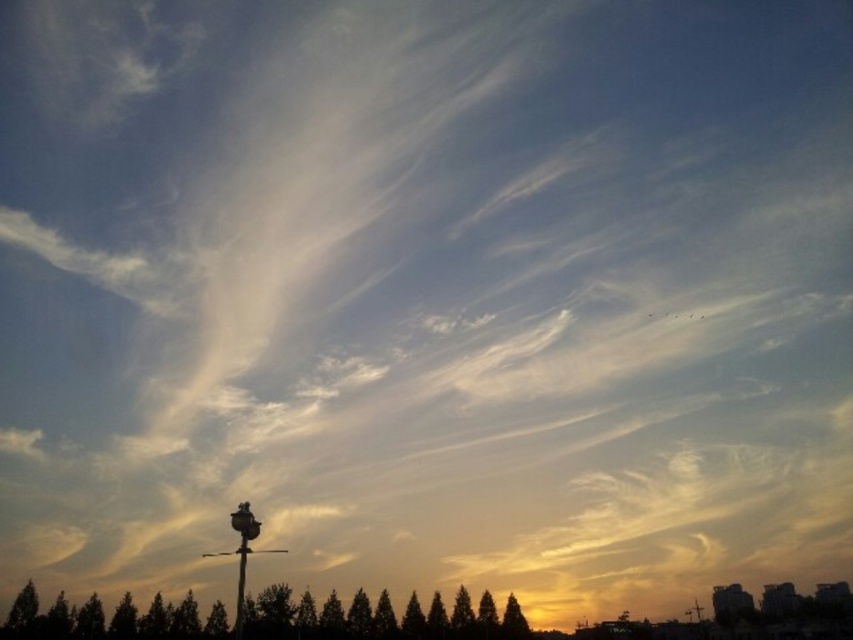
You are an astronomer observing the sky and notice the satin black lamp post at lower center. Based on its position at coordinates point 0.869, 0.285, can you determine if it is closer to the top or bottom of the image?

The satin black lamp post at lower center is located at point (242,556). Since the y coordinate 0.285 is closer to 0 than 1, it is closer to the bottom of the image.

You are standing in the middle of a street with a streetlamp ahead. You see green matte trees at lower center located at point (367, 618). Are the green matte trees at lower center closer to you or farther away compared to the streetlamp?

The green matte trees at lower center located at point (367, 618) are closer to you than the streetlamp because in the scene description, the streetlamp is in the foreground, which is typically closer, but the objects description specifies that the trees are at lower center which might be positioned behind or in front. Wait, there might be confusion here. Let me check again. The scene says the streetlamp is in the foreground, so foreground elements are closer. The objects description says the trees are at

You are an astronomer observing the sky scene. You notice two points in the sky, one at coordinates point (477, 630) and the other at point (245, 556). Which point is closer to the horizon?

Point (245, 556) is closer to the horizon because it is in front of point (477, 630), which is behind it.